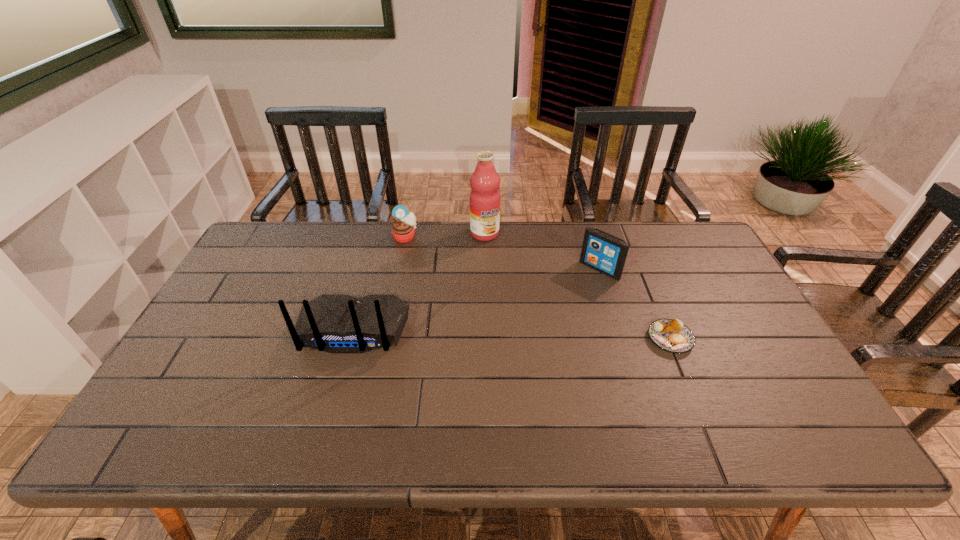
Image resolution: width=960 pixels, height=540 pixels. What are the coordinates of `fruit juice that is positioned at the far edge` in the screenshot? It's located at (484, 200).

This screenshot has height=540, width=960. Find the location of `iPod situated at the far edge`. iPod situated at the far edge is located at coordinates (605, 253).

Identify the location of free space at the far edge. (347, 227).

Where is `vacant point at the near edge`? This screenshot has height=540, width=960. vacant point at the near edge is located at coordinates (231, 401).

In the image, there is a desktop. Where is `vacant region at the left edge`? This screenshot has height=540, width=960. vacant region at the left edge is located at coordinates (249, 331).

The width and height of the screenshot is (960, 540). What are the coordinates of `vacant space at the right edge of the desktop` in the screenshot? It's located at (728, 374).

Locate an element on the screen. free space at the far left corner of the desktop is located at coordinates (306, 230).

The height and width of the screenshot is (540, 960). In the image, there is a desktop. Identify the location of free region at the near left corner. (213, 396).

Image resolution: width=960 pixels, height=540 pixels. Identify the location of free space between the third nearest object and the muffin. (502, 253).

You are a GUI agent. You are given a task and a screenshot of the screen. Output one action in this format:
    pyautogui.click(x=<x>, y=<y>)
    Task: Click on the free space between the tallest object and the shortest object
    This screenshot has width=960, height=540.
    Given the screenshot: What is the action you would take?
    pyautogui.click(x=577, y=286)